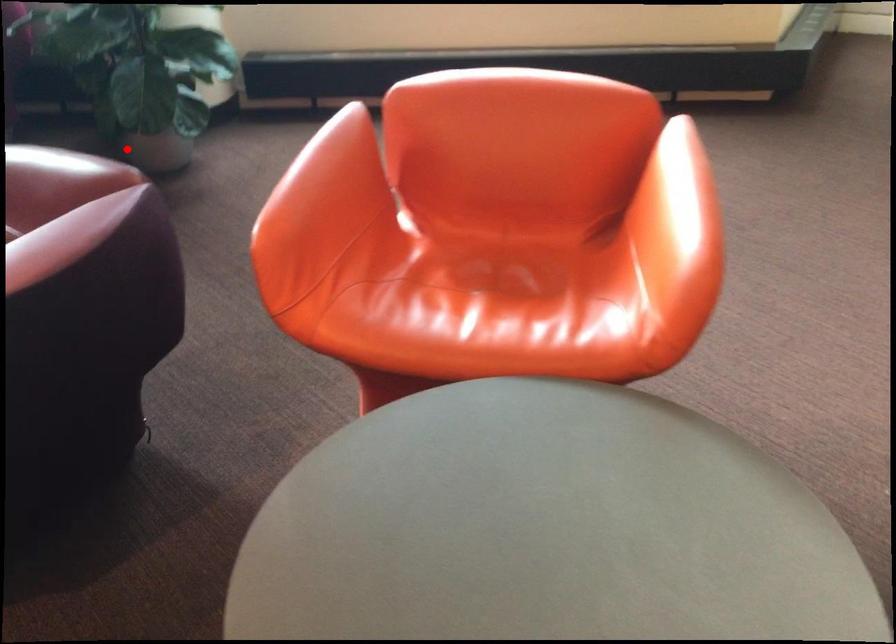
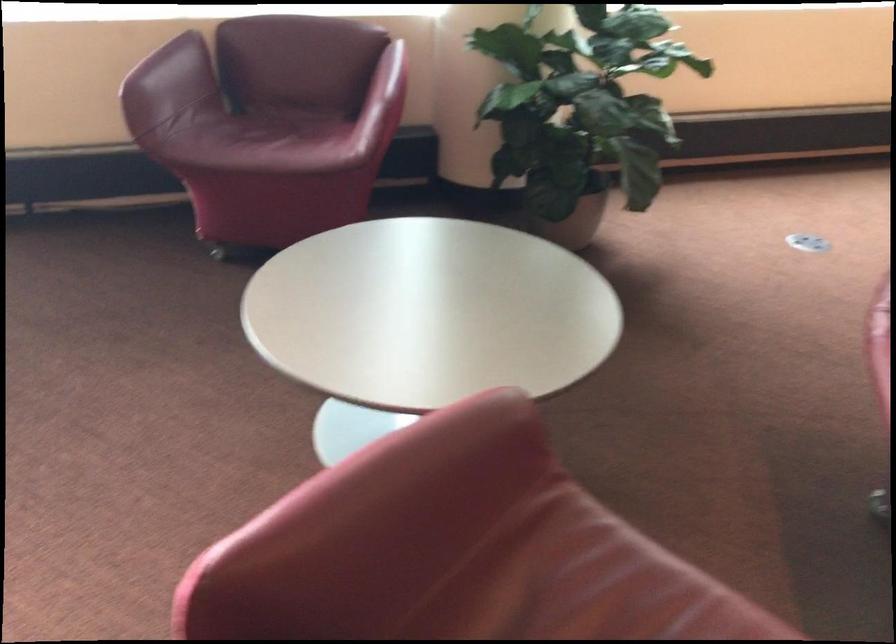
Where in the second image is the point corresponding to the highlighted location from the first image?

(573, 223)